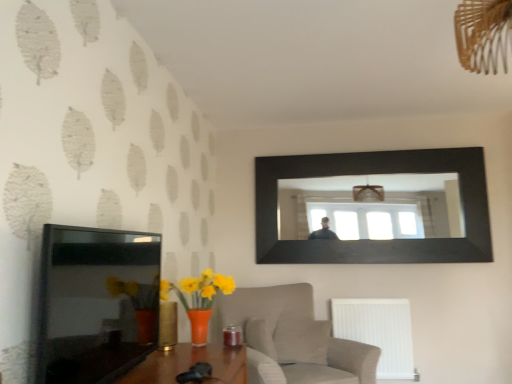
Question: Is textured beige armchair at lower center inside the boundaries of black glossy picture frame at upper center, which is counted as the 2th picture frame, starting from the front, or outside?

Choices:
 (A) inside
 (B) outside

Answer: (B)

Question: Does point (266, 306) appear closer or farther from the camera than point (467, 157)?

Choices:
 (A) closer
 (B) farther

Answer: (A)

Question: Which is farther from the black glossy picture frame at upper center, which is the 2th picture frame in left-to-right order?

Choices:
 (A) textured beige armchair at lower center
 (B) black glossy tv at left, the second picture frame when ordered from back to front
 (C) white plastic radiator at lower right

Answer: (B)

Question: Which is farther from the black glossy picture frame at upper center, which is the first picture frame in back-to-front order?

Choices:
 (A) black glossy tv at left, placed as the first picture frame when sorted from front to back
 (B) textured beige armchair at lower center
 (C) white plastic radiator at lower right

Answer: (A)